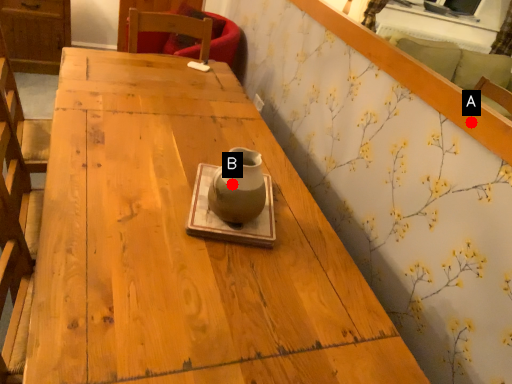
Question: Two points are circled on the image, labeled by A and B beside each circle. Which point is closer to the camera?

Choices:
 (A) A is closer
 (B) B is closer

Answer: (B)